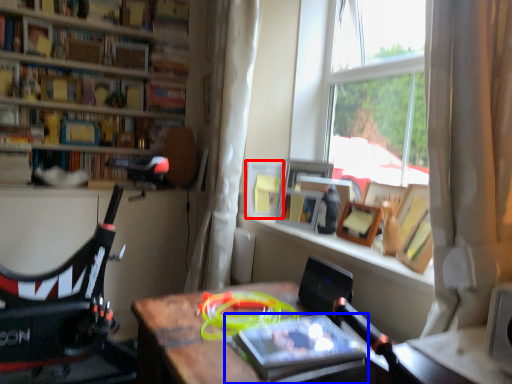
Question: Among these objects, which one is farthest to the camera, picture frame (highlighted by a red box) or book (highlighted by a blue box)?

Choices:
 (A) picture frame
 (B) book

Answer: (A)